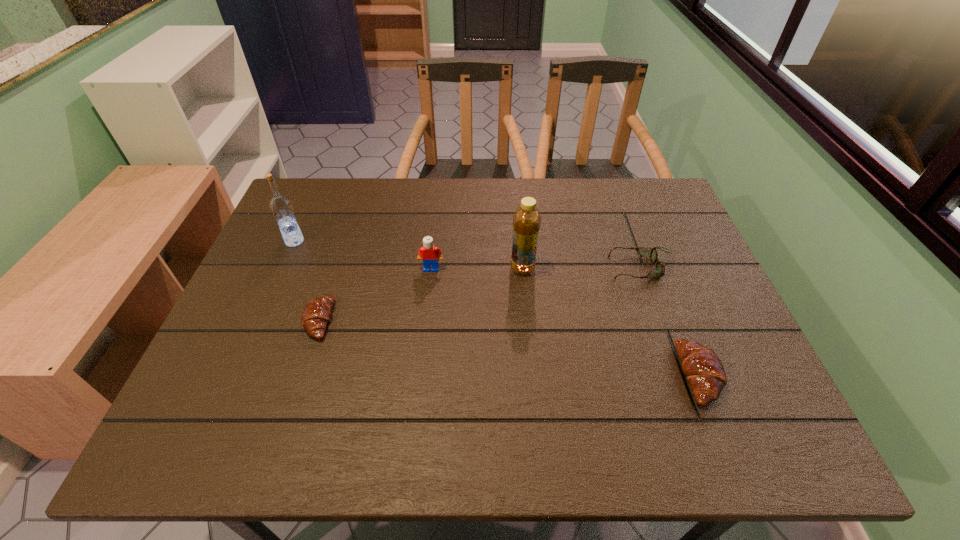
Locate an element on the screen. The height and width of the screenshot is (540, 960). blank space located 0.060m on the front of the left crescent roll is located at coordinates (304, 364).

Find the location of a particular element. The image size is (960, 540). free region located on the left of the taller crescent roll is located at coordinates (499, 375).

This screenshot has height=540, width=960. I want to click on free space located 0.290m on the front of the leftmost object, so click(255, 332).

Locate an element on the screen. This screenshot has height=540, width=960. free location located 0.390m on the front-facing side of the spectacles is located at coordinates (464, 268).

You are a GUI agent. You are given a task and a screenshot of the screen. Output one action in this format:
    pyautogui.click(x=<x>, y=<y>)
    Task: Click on the blank space located 0.140m on the front-facing side of the spectacles
    This screenshot has width=960, height=540.
    Given the screenshot: What is the action you would take?
    pyautogui.click(x=558, y=268)

Locate an element on the screen. vacant space located on the front-facing side of the spectacles is located at coordinates (584, 268).

Find the location of a particular element. This screenshot has width=960, height=540. vacant space situated on the front of the third object from right to left is located at coordinates (536, 404).

Image resolution: width=960 pixels, height=540 pixels. I want to click on blank space located 0.110m on the face of the third tallest object, so click(427, 304).

Where is `object at the near edge`? The width and height of the screenshot is (960, 540). object at the near edge is located at coordinates (702, 367).

Where is `object present at the left edge`? Image resolution: width=960 pixels, height=540 pixels. object present at the left edge is located at coordinates (281, 207).